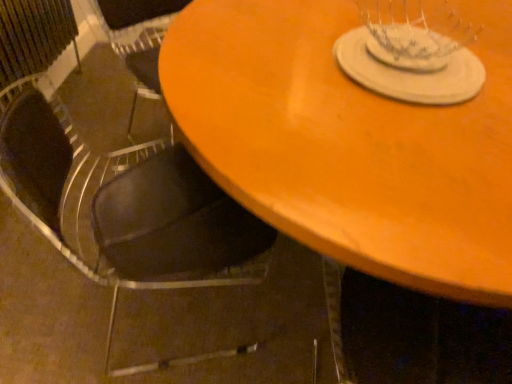
Identify the location of vacant area that is in front of white matte glass plate at upper center. The height and width of the screenshot is (384, 512). (400, 144).